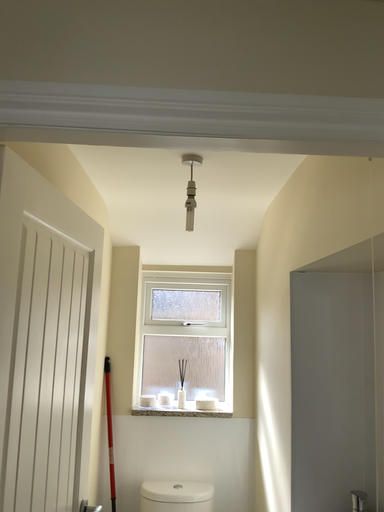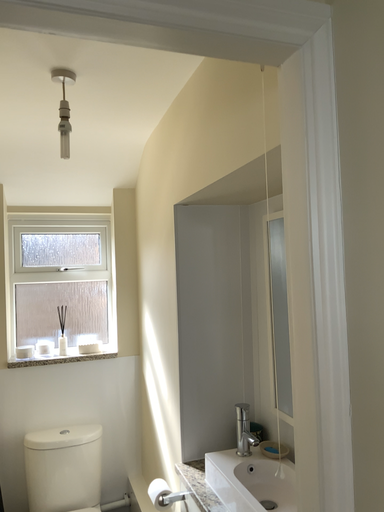
Question: Which way did the camera rotate in the video?

Choices:
 (A) rotated right
 (B) rotated left

Answer: (A)